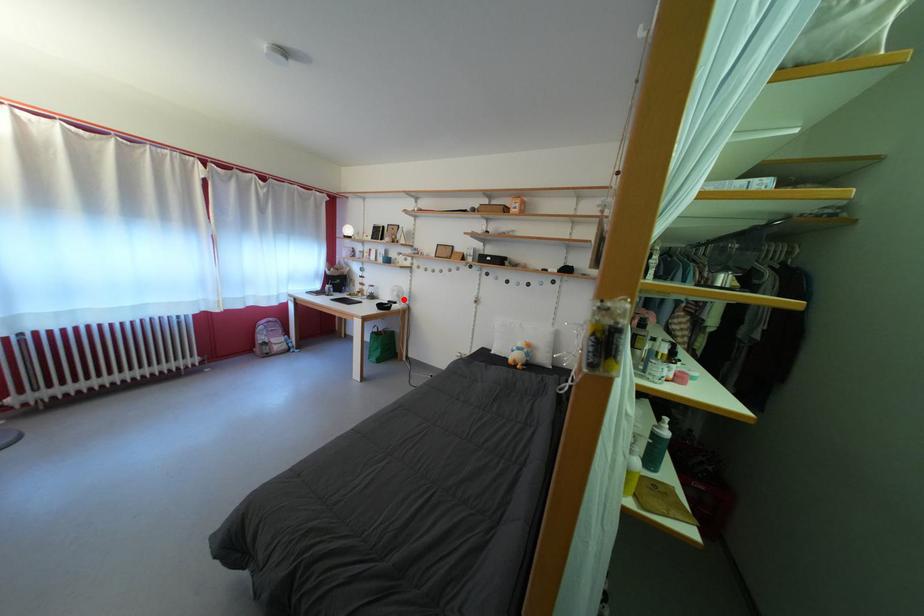
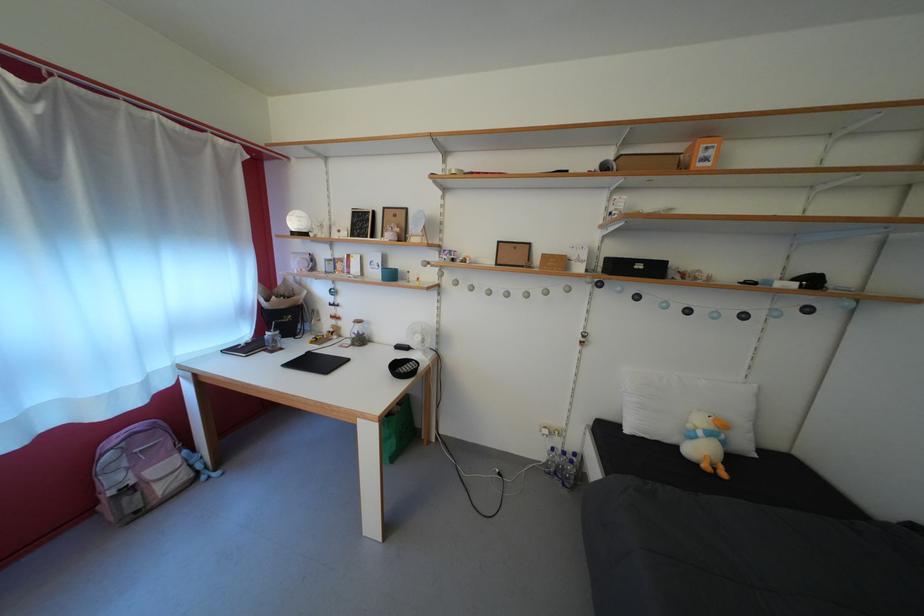
Where in the second image is the point corresponding to the highlighted location from the first image?

(427, 344)